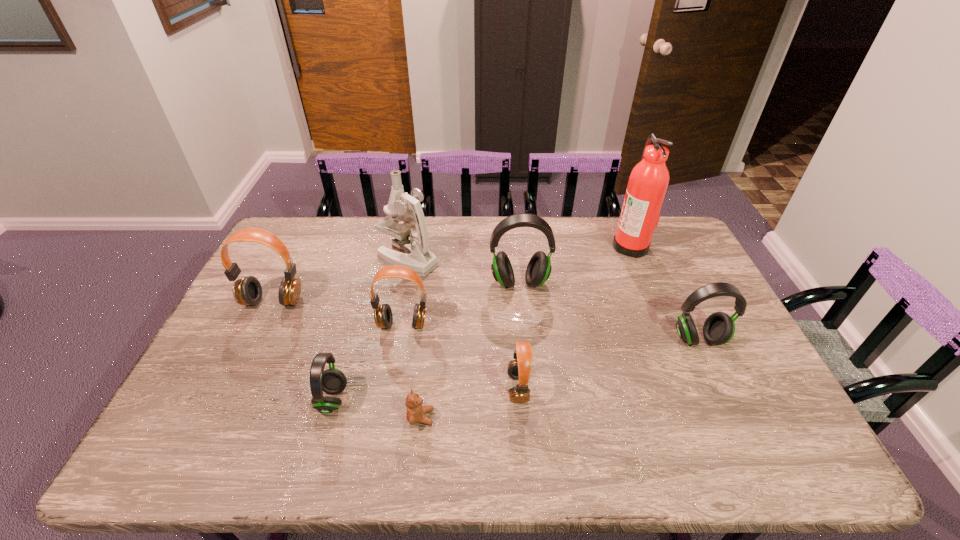
You are a GUI agent. You are given a task and a screenshot of the screen. Output one action in this format:
    pyautogui.click(x=<x>, y=<y>)
    Task: Click on the vacant space located 0.160m on the right of the microscope
    The image size is (960, 540).
    Given the screenshot: What is the action you would take?
    pyautogui.click(x=485, y=259)

You are a GUI agent. You are given a task and a screenshot of the screen. Output one action in this format:
    pyautogui.click(x=<x>, y=<y>)
    Task: Click on the free space located 0.240m on the ear cups of the farthest black headset
    The width and height of the screenshot is (960, 540).
    Given the screenshot: What is the action you would take?
    pyautogui.click(x=527, y=356)

You are a GUI agent. You are given a task and a screenshot of the screen. Output one action in this format:
    pyautogui.click(x=<x>, y=<y>)
    Task: Click on the vacant space situated on the ear cups of the leftmost brown headset
    This screenshot has width=960, height=540.
    Given the screenshot: What is the action you would take?
    pyautogui.click(x=223, y=404)

At what (x,y) coordinates should I click in order to perform the action: click on free space located on the ear cups of the second biggest black headset. Please return your answer as a coordinate pair (x, y). The image size is (960, 540). Looking at the image, I should click on (717, 380).

The width and height of the screenshot is (960, 540). I want to click on blank space located on the ear cups of the third headset from left to right, so click(389, 403).

Locate an element on the screen. The image size is (960, 540). free spot located 0.160m on the ear cups of the smallest brown headset is located at coordinates (445, 388).

You are a GUI agent. You are given a task and a screenshot of the screen. Output one action in this format:
    pyautogui.click(x=<x>, y=<y>)
    Task: Click on the vacant space located on the ear cups of the smallest brown headset
    The height and width of the screenshot is (540, 960).
    Given the screenshot: What is the action you would take?
    pyautogui.click(x=369, y=388)

This screenshot has width=960, height=540. What are the coordinates of `vacant space positioned on the ear cups of the smallest brown headset` in the screenshot? It's located at (392, 388).

Where is `free space located on the ear cups of the smallest black headset`? The height and width of the screenshot is (540, 960). free space located on the ear cups of the smallest black headset is located at coordinates (485, 400).

Image resolution: width=960 pixels, height=540 pixels. Identify the location of vacant space located on the face of the teddy bear. (531, 417).